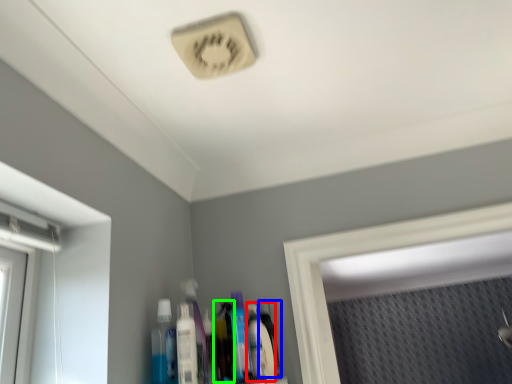
Question: Based on their relative distances, which object is nearer to mouthwash (highlighted by a red box)? Choose from bottle (highlighted by a blue box) and toiletry (highlighted by a green box).

Choices:
 (A) bottle
 (B) toiletry

Answer: (B)